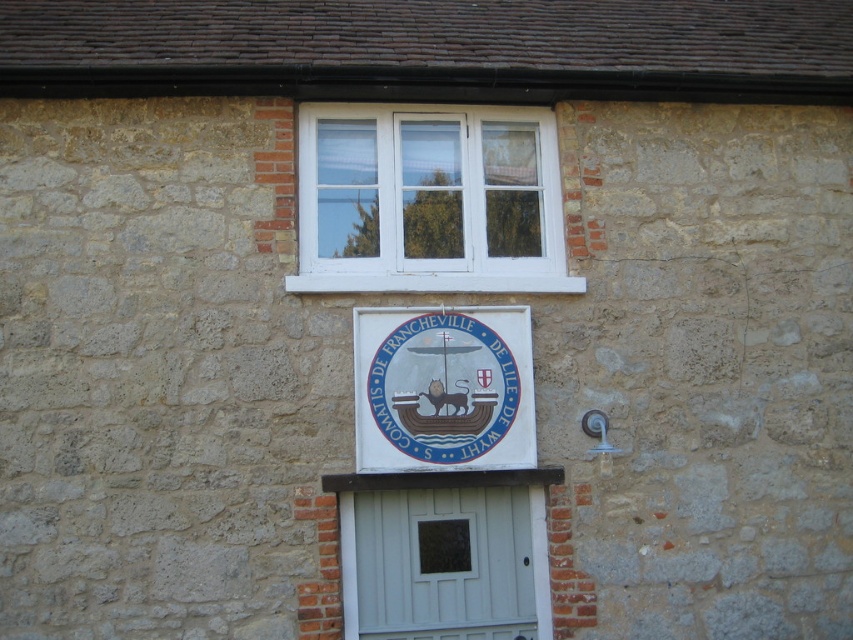
Question: Which object appears closest to the camera in this image?

Choices:
 (A) white plastic window at upper center
 (B) white painted wood door at center

Answer: (B)

Question: Which object appears farthest from the camera in this image?

Choices:
 (A) white plastic window at upper center
 (B) white glossy sign at center
 (C) white painted wood door at center

Answer: (A)

Question: Where is white plastic window at upper center located in relation to white painted wood door at center in the image?

Choices:
 (A) right
 (B) left

Answer: (B)

Question: Can you confirm if white painted wood door at center is wider than white glossy sign at center?

Choices:
 (A) no
 (B) yes

Answer: (B)

Question: Is white plastic window at upper center thinner than white painted wood door at center?

Choices:
 (A) yes
 (B) no

Answer: (B)

Question: Which point is farther to the camera?

Choices:
 (A) (352, 620)
 (B) (360, 198)

Answer: (B)